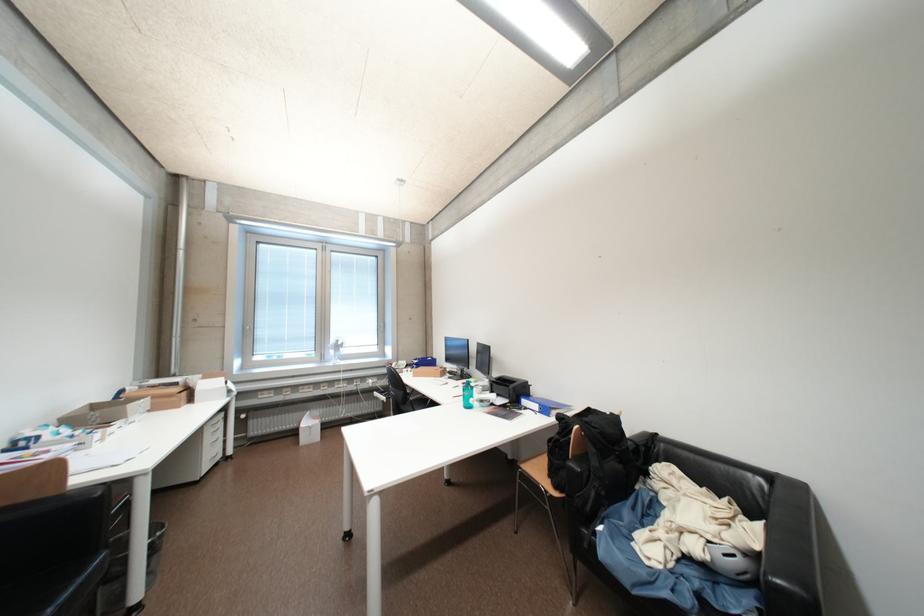
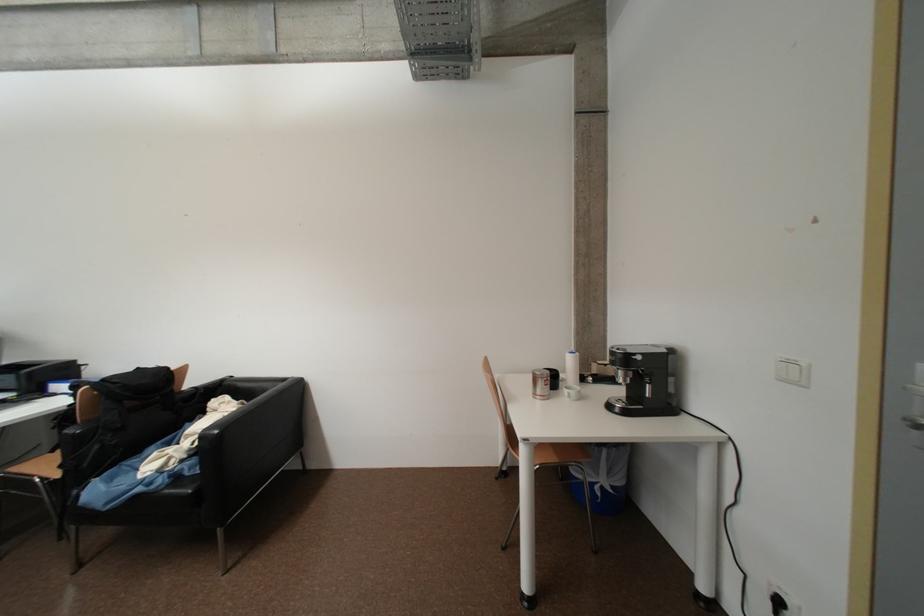
Where in the second image is the point corresponding to point (650, 575) from the first image?

(130, 488)